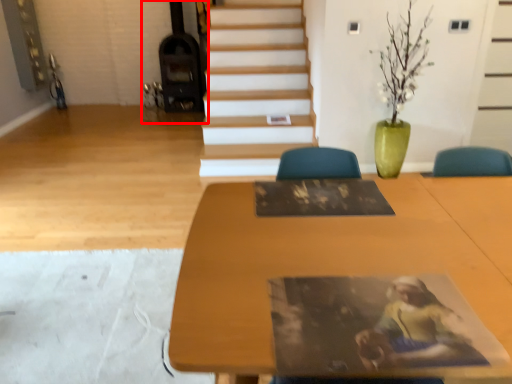
Question: Considering the relative positions of fireplace (annotated by the red box) and table in the image provided, where is fireplace (annotated by the red box) located with respect to the staircase?

Choices:
 (A) right
 (B) left

Answer: (B)